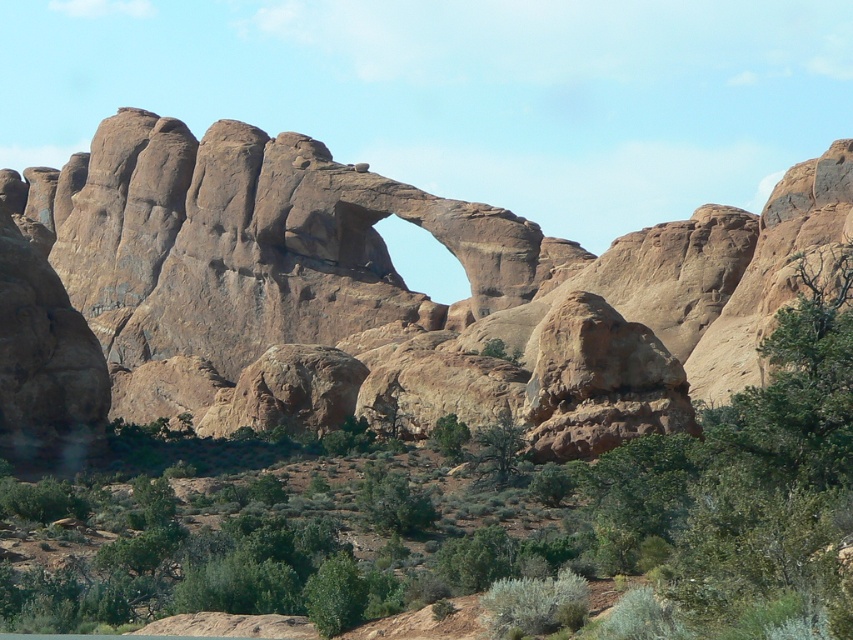
Question: Can you confirm if rustic sandstone arch at center is smaller than green leafy shrubs at center?

Choices:
 (A) yes
 (B) no

Answer: (B)

Question: Which point is closer to the camera?

Choices:
 (A) rustic sandstone arch at center
 (B) green leafy shrubs at center

Answer: (B)

Question: Observing the image, what is the correct spatial positioning of rustic sandstone arch at center in reference to green leafy shrubs at center?

Choices:
 (A) below
 (B) above

Answer: (B)

Question: Does rustic sandstone arch at center have a lesser width compared to green leafy shrubs at center?

Choices:
 (A) yes
 (B) no

Answer: (B)

Question: Which point is farther from the camera taking this photo?

Choices:
 (A) (242, 492)
 (B) (380, 244)

Answer: (B)